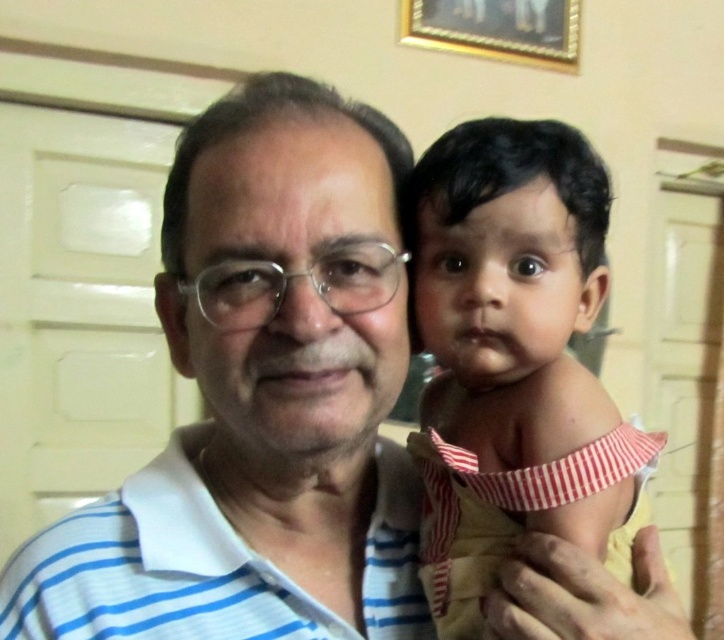
Please look at the image and locate the point at coordinates (260,400). Which object does this point correspond to?

The point at coordinates (260,400) corresponds to the white striped polo shirt at center.

Looking at this image, you are a photographer setting up a shoot in this scene. You need to place a small prop between the white striped polo shirt at center and the soft beige cloth at right. Based on their positions, where should you place the prop so it is between them?

The white striped polo shirt at center is above the soft beige cloth at right, so you should place the prop in between them vertically. Position it below the white striped polo shirt at center and above the soft beige cloth at right to ensure it is between both objects.